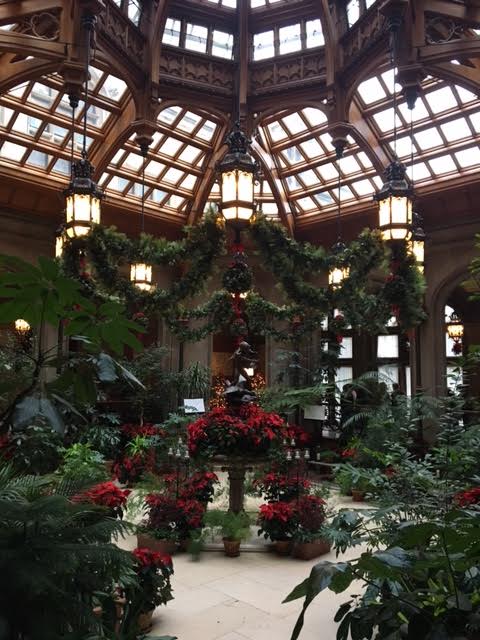
Locate an element on the screen. This screenshot has height=640, width=480. top left wood molding of base of ceiling windows is located at coordinates (160, 208), (42, 178).